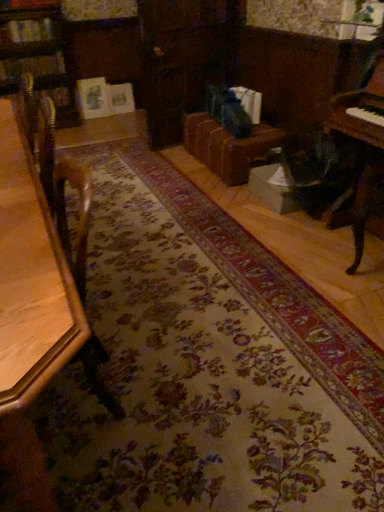
Question: Considering the relative sizes of brown leather couch at center and wooden table at left in the image provided, is brown leather couch at center taller than wooden table at left?

Choices:
 (A) yes
 (B) no

Answer: (B)

Question: From a real-world perspective, is brown leather couch at center under wooden table at left?

Choices:
 (A) yes
 (B) no

Answer: (A)

Question: Considering the relative sizes of brown leather couch at center and wooden table at left in the image provided, is brown leather couch at center shorter than wooden table at left?

Choices:
 (A) yes
 (B) no

Answer: (A)

Question: Considering the relative sizes of brown leather couch at center and wooden table at left in the image provided, is brown leather couch at center wider than wooden table at left?

Choices:
 (A) no
 (B) yes

Answer: (B)

Question: Is there a large distance between brown leather couch at center and wooden table at left?

Choices:
 (A) no
 (B) yes

Answer: (B)

Question: Does brown leather couch at center lie behind wooden table at left?

Choices:
 (A) yes
 (B) no

Answer: (A)

Question: Does wooden table at left have a larger size compared to brown leather couch at center?

Choices:
 (A) no
 (B) yes

Answer: (A)

Question: Does wooden table at left contain brown leather couch at center?

Choices:
 (A) no
 (B) yes

Answer: (A)

Question: Considering the relative positions of wooden table at left and brown leather couch at center in the image provided, is wooden table at left in front of brown leather couch at center?

Choices:
 (A) yes
 (B) no

Answer: (A)

Question: Are wooden table at left and brown leather couch at center located far from each other?

Choices:
 (A) yes
 (B) no

Answer: (A)

Question: Is wooden table at left behind brown leather couch at center?

Choices:
 (A) yes
 (B) no

Answer: (B)

Question: Does wooden table at left have a smaller size compared to brown leather couch at center?

Choices:
 (A) yes
 (B) no

Answer: (A)

Question: Would you say wooden table at left is a long distance from wooden piano at right?

Choices:
 (A) yes
 (B) no

Answer: (A)